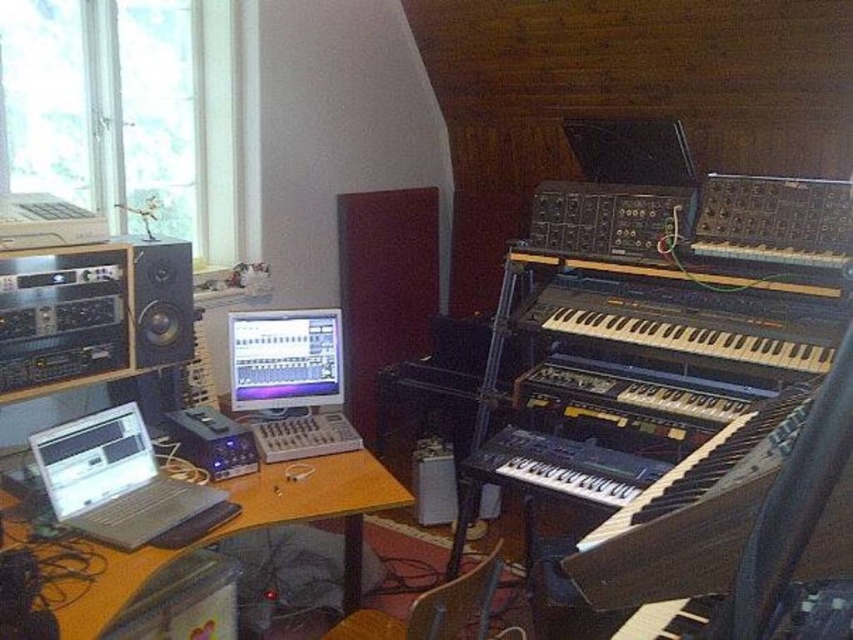
Question: Which point is closer to the camera taking this photo?

Choices:
 (A) pos(187,538)
 (B) pos(155,268)

Answer: (A)

Question: Which point is farther to the camera?

Choices:
 (A) matte black monitor at center
 (B) matte black speaker at left
 (C) wooden desk at center
 (D) black plastic keyboard at center-right

Answer: (A)

Question: Based on their relative distances, which object is farther from the matte black speaker at left?

Choices:
 (A) silver metallic laptop at lower left
 (B) black plastic keyboard at center-right

Answer: (B)

Question: Is black plastic keyboard at center-right thinner than wooden desk at center?

Choices:
 (A) no
 (B) yes

Answer: (B)

Question: Does black plastic keyboard at center-right appear over matte black monitor at center?

Choices:
 (A) no
 (B) yes

Answer: (B)

Question: Can you confirm if black plastic keyboard at center-right is positioned above silver metallic laptop at lower left?

Choices:
 (A) no
 (B) yes

Answer: (B)